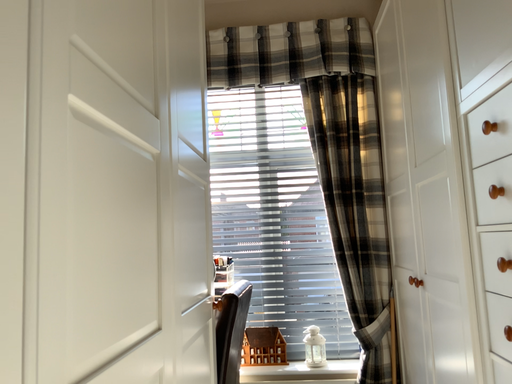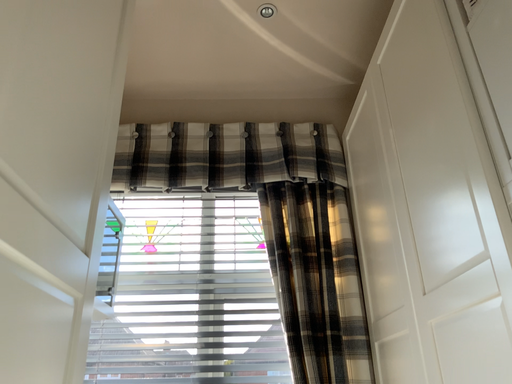
Question: How did the camera likely rotate when shooting the video?

Choices:
 (A) rotated upward
 (B) rotated downward

Answer: (A)